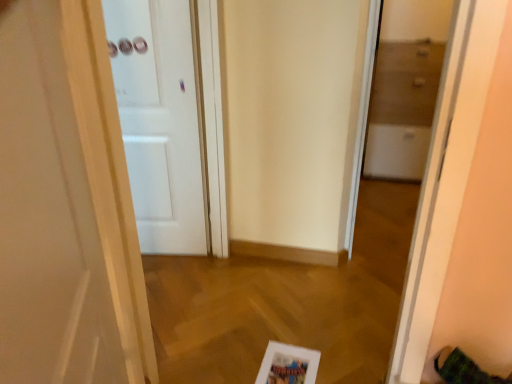
Question: Considering the relative sizes of transparent glass cabinet at right and white glossy door at left, acting as the first door starting from the front, in the image provided, is transparent glass cabinet at right taller than white glossy door at left, acting as the first door starting from the front,?

Choices:
 (A) yes
 (B) no

Answer: (A)

Question: From the image's perspective, would you say transparent glass cabinet at right is shown under white glossy door at left, the second door viewed from the back?

Choices:
 (A) yes
 (B) no

Answer: (B)

Question: From a real-world perspective, is transparent glass cabinet at right physically below white glossy door at left, the second door viewed from the back?

Choices:
 (A) no
 (B) yes

Answer: (B)

Question: Is transparent glass cabinet at right wider than white glossy door at left, acting as the first door starting from the front?

Choices:
 (A) no
 (B) yes

Answer: (B)

Question: Is there a large distance between transparent glass cabinet at right and white glossy door at left, the second door viewed from the back?

Choices:
 (A) no
 (B) yes

Answer: (B)

Question: From their relative heights in the image, would you say white matte door at center, the second door in the front-to-back sequence, is taller or shorter than white matte picture frame at lower center?

Choices:
 (A) short
 (B) tall

Answer: (B)

Question: Is white matte door at center, the second door in the front-to-back sequence, in front of or behind white matte picture frame at lower center in the image?

Choices:
 (A) behind
 (B) front

Answer: (A)

Question: From a real-world perspective, relative to white matte picture frame at lower center, is white matte door at center, which appears as the 1th door when viewed from the back, vertically above or below?

Choices:
 (A) above
 (B) below

Answer: (A)

Question: From the image's perspective, relative to white matte picture frame at lower center, is white matte door at center, which appears as the 1th door when viewed from the back, above or below?

Choices:
 (A) below
 (B) above

Answer: (B)

Question: Is transparent glass cabinet at right in front of or behind white glossy door at left, the second door viewed from the back, in the image?

Choices:
 (A) front
 (B) behind

Answer: (B)

Question: Based on their positions, is transparent glass cabinet at right located to the left or right of white glossy door at left, the second door viewed from the back?

Choices:
 (A) right
 (B) left

Answer: (A)

Question: Is transparent glass cabinet at right bigger or smaller than white glossy door at left, acting as the first door starting from the front?

Choices:
 (A) small
 (B) big

Answer: (A)

Question: From a real-world perspective, is transparent glass cabinet at right physically located above or below white glossy door at left, acting as the first door starting from the front?

Choices:
 (A) below
 (B) above

Answer: (A)

Question: In the image, is white glossy door at left, acting as the first door starting from the front, positioned in front of or behind transparent glass cabinet at right?

Choices:
 (A) front
 (B) behind

Answer: (A)

Question: From a real-world perspective, relative to transparent glass cabinet at right, is white glossy door at left, the second door viewed from the back, vertically above or below?

Choices:
 (A) below
 (B) above

Answer: (B)